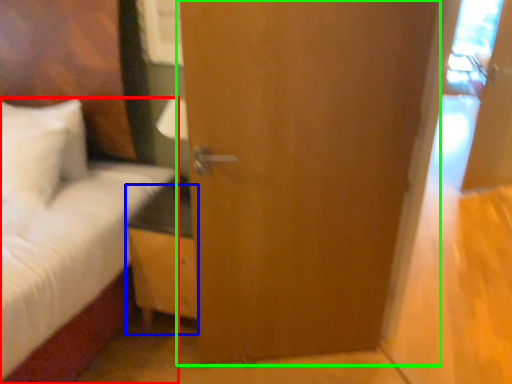
Question: Which object is positioned farthest from bed (highlighted by a red box)? Select from nightstand (highlighted by a blue box) and door (highlighted by a green box).

Choices:
 (A) nightstand
 (B) door

Answer: (B)